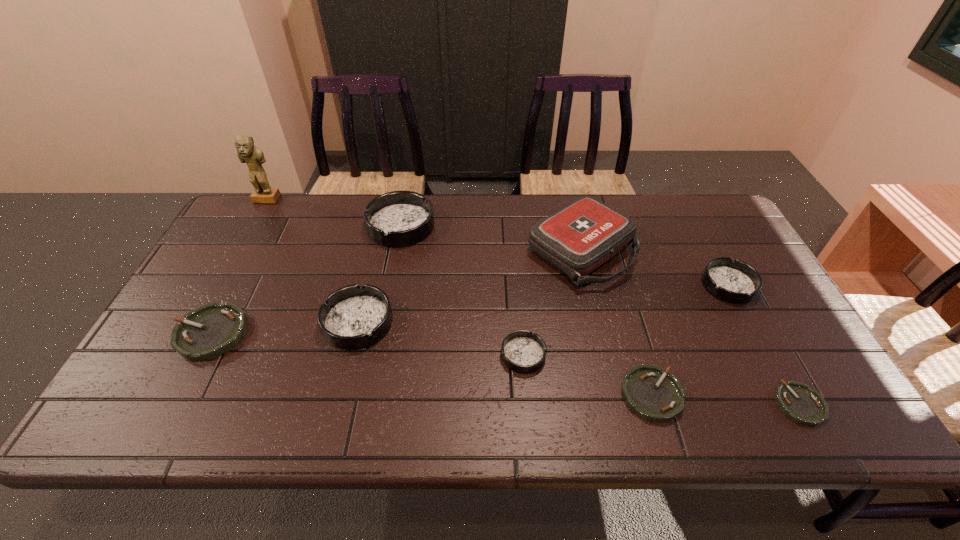
Image resolution: width=960 pixels, height=540 pixels. In order to click on the leftmost green ashtray in this screenshot , I will do `click(211, 330)`.

Locate an element on the screen. The image size is (960, 540). the smallest dark ashtray is located at coordinates (522, 351).

Where is `the third dark ashtray from left to right`? the third dark ashtray from left to right is located at coordinates (522, 351).

At what (x,y) coordinates should I click in order to perform the action: click on the eighth tallest object. Please return your answer as a coordinate pair (x, y). Looking at the image, I should click on (650, 392).

Locate an element on the screen. This screenshot has width=960, height=540. the second green ashtray from left to right is located at coordinates (650, 392).

The image size is (960, 540). What are the coordinates of `the shortest object` in the screenshot? It's located at (796, 400).

The width and height of the screenshot is (960, 540). Find the location of `the shortest ashtray`. the shortest ashtray is located at coordinates (796, 400).

The width and height of the screenshot is (960, 540). I want to click on vacant space located on the front-facing side of the figurine, so click(227, 272).

You are a GUI agent. You are given a task and a screenshot of the screen. Output one action in this format:
    pyautogui.click(x=<x>, y=<y>)
    Task: Click on the vacant space situated 0.100m on the back of the eighth shortest object
    This screenshot has width=960, height=540.
    Given the screenshot: What is the action you would take?
    pos(568,197)

The width and height of the screenshot is (960, 540). Find the location of `free space located 0.190m on the left of the seventh shortest object`. free space located 0.190m on the left of the seventh shortest object is located at coordinates (307, 226).